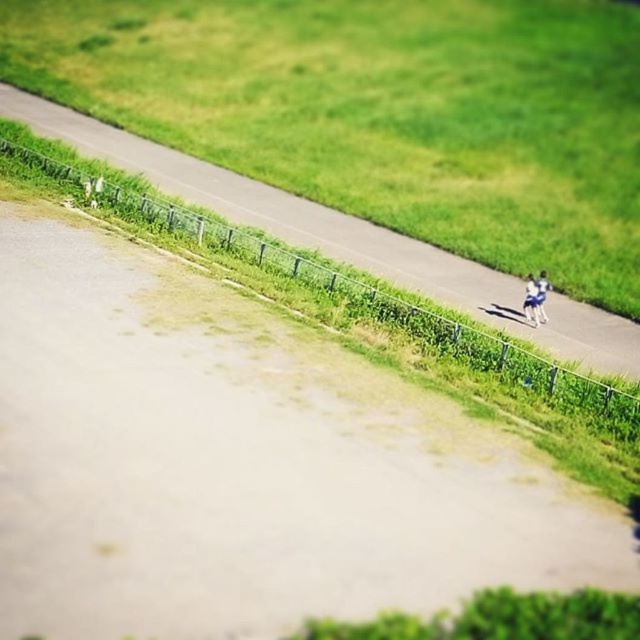
Which is behind, point (536, 285) or point (544, 273)?

Positioned behind is point (544, 273).

Does point (532, 301) lie behind point (541, 288)?

No, (532, 301) is closer to viewer.

Identify the location of blue denim shorts at right. (531, 300).

Measure the distance from asphalt road at center to blue denim shorts at right.

They are 9.64 meters apart.

Who is taller, asphalt road at center or blue denim shorts at right?

asphalt road at center is taller.

In order to click on asphalt road at center in this screenshot , I will do point(344,237).

Is point (276, 212) closer to camera compared to point (547, 282)?

That is False.

The height and width of the screenshot is (640, 640). Find the location of `asphalt road at center`. asphalt road at center is located at coordinates (344, 237).

Where is `asphalt road at center`? This screenshot has width=640, height=640. asphalt road at center is located at coordinates (344, 237).